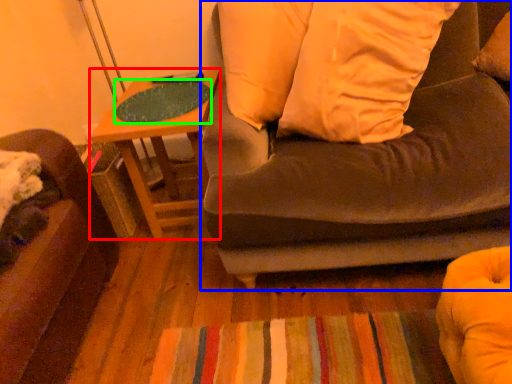
Question: Considering the real-world distances, which object is farthest from table (highlighted by a red box)? studio couch (highlighted by a blue box) or table top (highlighted by a green box)?

Choices:
 (A) studio couch
 (B) table top

Answer: (A)